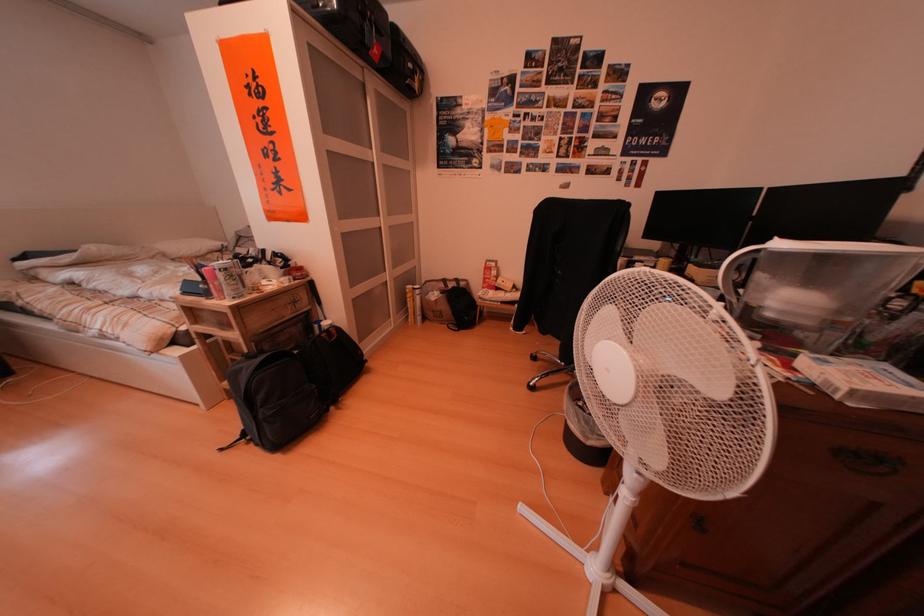
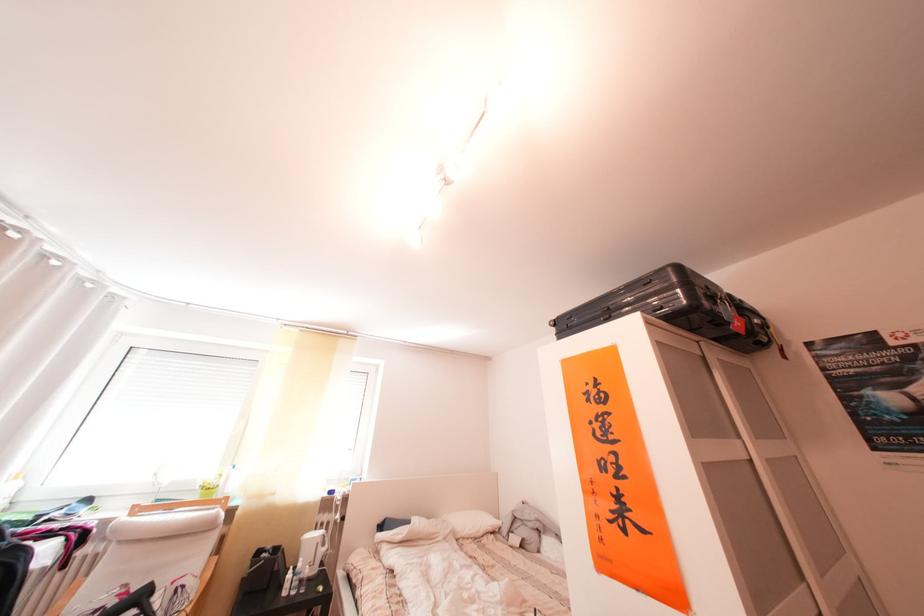
Where in the second image is the point corresponding to point (383, 154) from the first image?

(751, 442)